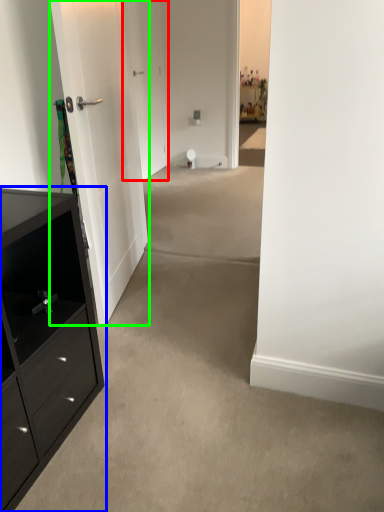
Question: Based on their relative distances, which object is farther from door (highlighted by a red box)? Choose from chest of drawers (highlighted by a blue box) and door (highlighted by a green box).

Choices:
 (A) chest of drawers
 (B) door

Answer: (A)